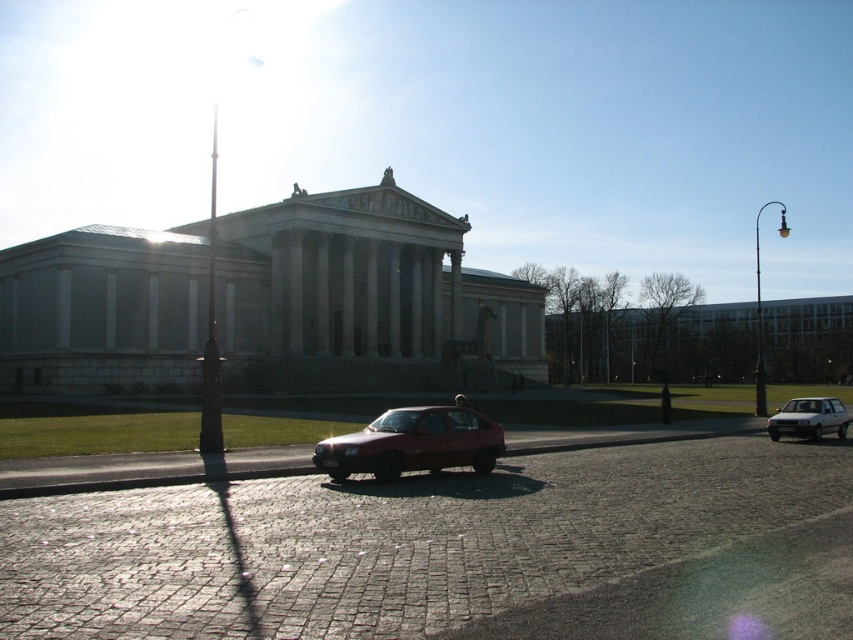
You are a photographer planning to take a photo of the classical building with both the matte red car at center and the silver metallic hatchback at right in the frame. Which car should be positioned closer to the camera to ensure both are visible without overlapping?

The matte red car at center should be positioned closer to the camera since it is already closer to the viewer than the silver metallic hatchback at right, ensuring both cars are visible without overlapping.

You are driving a car and want to park in the space between the matte red car at center and the silver metallic hatchback at right. Which direction should you drive to park between them?

You should drive to the left side of the silver metallic hatchback at right to park between the matte red car at center and the silver metallic hatchback at right since the matte red car at center is positioned to the left of the silver metallic hatchback at right.

You are a parking attendant who needs to fit both the matte red car at center and the silver metallic hatchback at right into two adjacent parking spaces. The spaces are exactly the same width. Can you park both cars without any part of them extending beyond their respective spaces?

The matte red car at center has a lesser width compared to the silver metallic hatchback at right. Since the parking spaces are the same width, the silver metallic hatchback at right may not fit, but the matte red car at center should fit as long as its space is at least as wide as its own width. However, the silver metallic hatchback at right is wider, so its space might be too narrow unless adjusted.